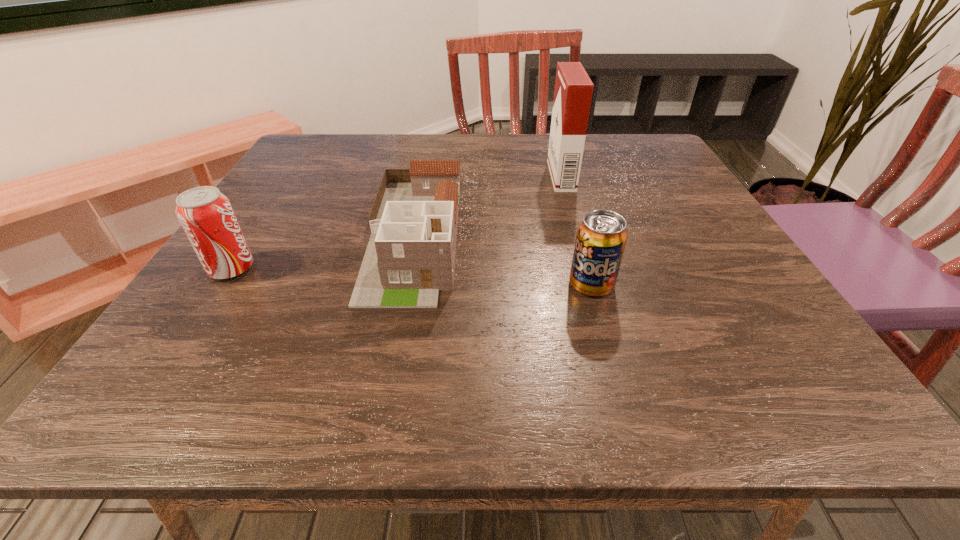
Identify the location of cigarette_case. This screenshot has height=540, width=960. (573, 91).

The image size is (960, 540). I want to click on the leftmost object, so click(206, 215).

This screenshot has height=540, width=960. Find the location of `the second object from left to right`. the second object from left to right is located at coordinates (410, 257).

This screenshot has width=960, height=540. I want to click on the shorter soda can, so click(601, 238).

Identify the location of free space located 0.300m on the front-facing side of the cigarette_case. (428, 176).

Where is `free space located 0.210m on the front-facing side of the cigarette_case`? This screenshot has width=960, height=540. free space located 0.210m on the front-facing side of the cigarette_case is located at coordinates (465, 176).

The width and height of the screenshot is (960, 540). Identify the location of vacant space located on the front-facing side of the cigarette_case. (441, 176).

Where is `free location located 0.090m on the logo side of the leftmost object`? Image resolution: width=960 pixels, height=540 pixels. free location located 0.090m on the logo side of the leftmost object is located at coordinates (302, 269).

Locate an element on the screen. This screenshot has height=540, width=960. free region located at the main entrance of the third object from right to left is located at coordinates (386, 383).

Image resolution: width=960 pixels, height=540 pixels. I want to click on vacant space located 0.320m on the left of the right soda can, so click(388, 285).